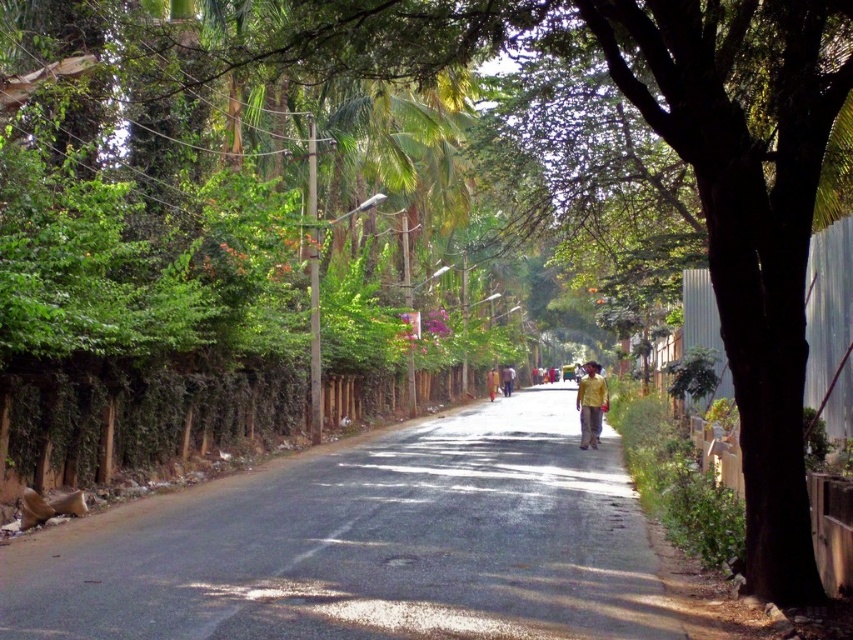
You are a delivery driver trying to navigate through the street scene. You see a yellow fabric person at center and a yellow fabric at center. Which one is wider?

The yellow fabric person at center is wider than the yellow fabric at center.

You are standing at the starting point of the road and want to walk towards the distant horizon. There are two points marked on the road ahead of you. Which point is closer to your current position? The points are labeled as point (471, 436) and point (604, 396).

Point (604, 396) is closer to your current position because it is in front of point (471, 436).

You are a pedestrian standing on the sidewalk and see the asphalt road at center and the yellow fabric shirt at center. Which object is closer to the ground?

The asphalt road at center is positioned under the yellow fabric shirt at center, so the asphalt road at center is closer to the ground.